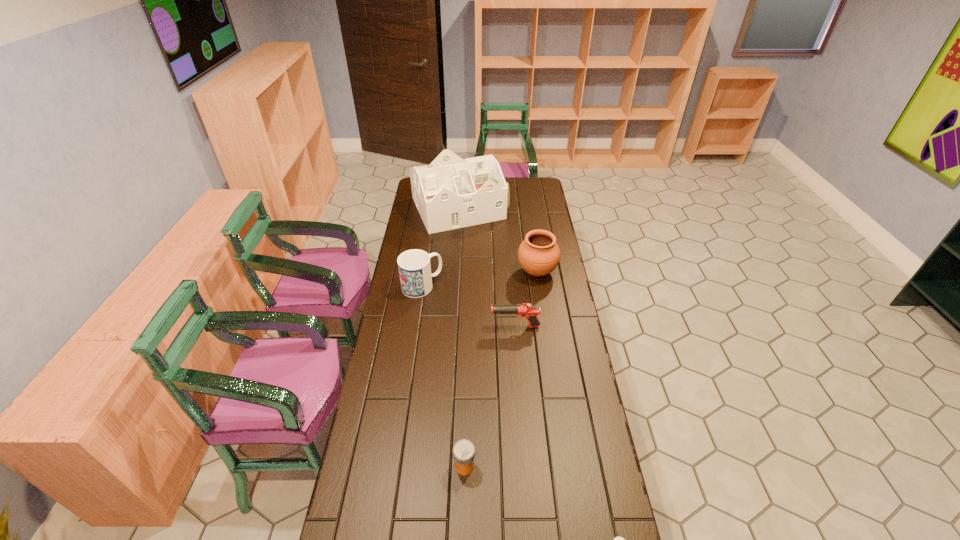
Identify the location of free location located 0.260m on the back of the third tallest object. This screenshot has height=540, width=960. (429, 240).

Image resolution: width=960 pixels, height=540 pixels. I want to click on vacant space located 0.210m at the aiming end of the gun, so click(x=438, y=326).

Find the location of `vacant space located 0.220m at the aiming end of the gun`. vacant space located 0.220m at the aiming end of the gun is located at coordinates (436, 326).

What are the coordinates of `vacant space located 0.380m at the aiming end of the gun` in the screenshot? It's located at (396, 326).

Find the location of a particular element. The image size is (960, 540). free space located 0.300m on the label side of the fifth farthest object is located at coordinates (574, 466).

I want to click on object located in the far edge section of the desktop, so click(x=450, y=193).

Identify the location of dollhouse present at the left edge. This screenshot has height=540, width=960. (450, 193).

At what (x,y) coordinates should I click in order to perform the action: click on mug that is positioned at the left edge. Please return your answer as a coordinate pair (x, y). Looking at the image, I should click on (414, 267).

Image resolution: width=960 pixels, height=540 pixels. Find the location of `pottery situated at the right edge`. pottery situated at the right edge is located at coordinates (538, 255).

The image size is (960, 540). In order to click on gun that is at the right edge in this screenshot , I will do `click(526, 310)`.